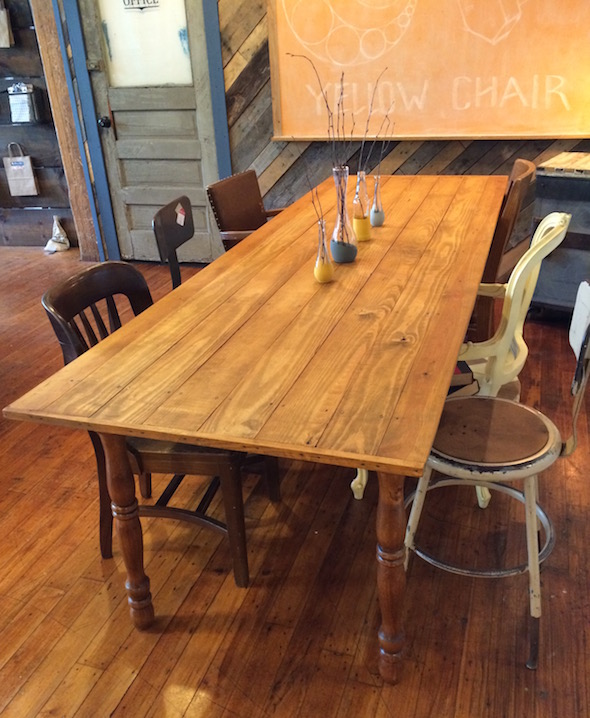
You are a GUI agent. You are given a task and a screenshot of the screen. Output one action in this format:
    pyautogui.click(x=<x>, y=<y>)
    Task: Click on the 8 panels for top of table
    The image size is (590, 718).
    Given the screenshot: What is the action you would take?
    pyautogui.click(x=51, y=386), pyautogui.click(x=81, y=393), pyautogui.click(x=133, y=411), pyautogui.click(x=172, y=414), pyautogui.click(x=231, y=421), pyautogui.click(x=281, y=429), pyautogui.click(x=347, y=434), pyautogui.click(x=404, y=444)